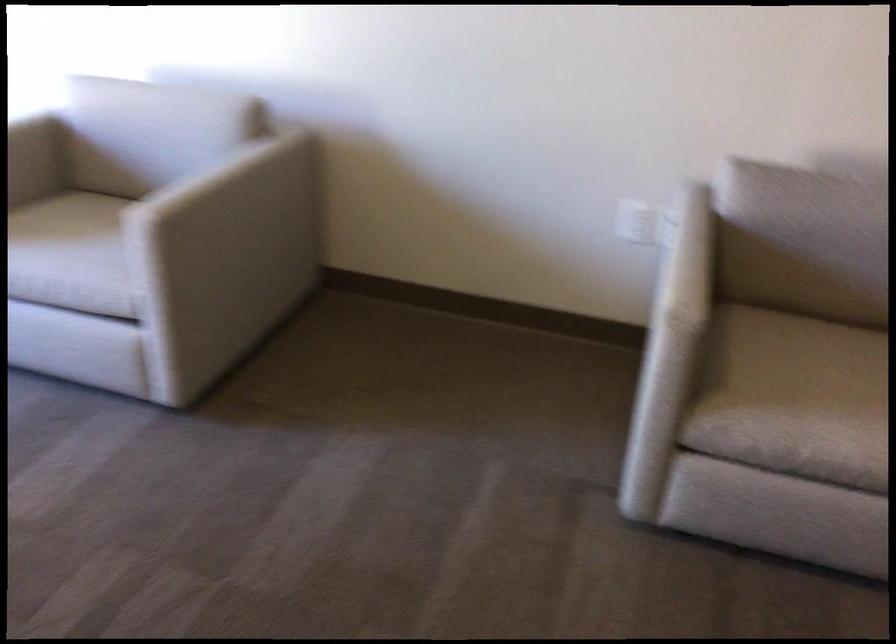
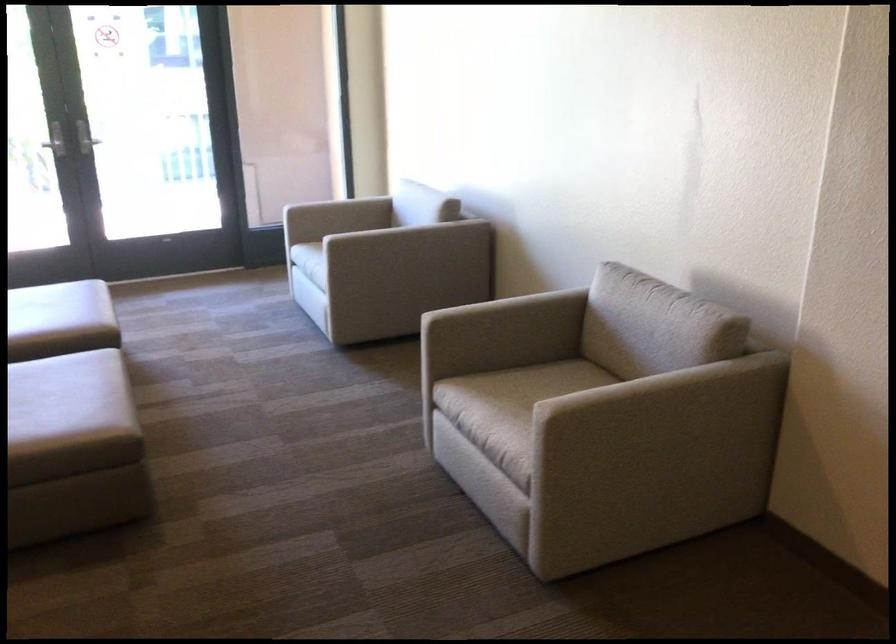
Locate, in the second image, the point that corresponds to [778,370] in the first image.

(513, 389)